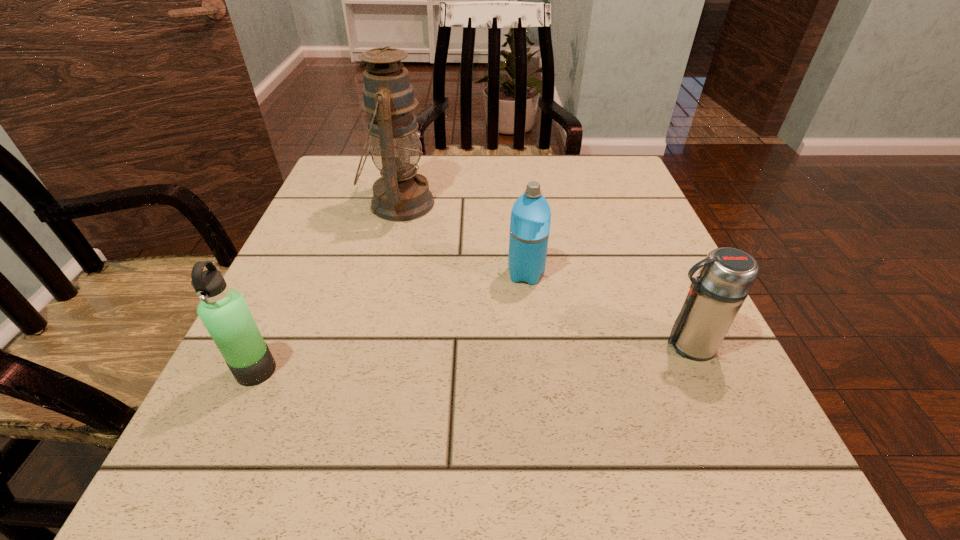
This screenshot has height=540, width=960. I want to click on free region located with a handle on the side of the rightmost thermos bottle, so click(x=532, y=345).

Where is `blank space located with a handle on the side of the rightmost thermos bottle`? Image resolution: width=960 pixels, height=540 pixels. blank space located with a handle on the side of the rightmost thermos bottle is located at coordinates (532, 345).

This screenshot has width=960, height=540. Find the location of `object located at the far edge`. object located at the far edge is located at coordinates (401, 194).

Locate an element on the screen. The width and height of the screenshot is (960, 540). oil lamp located at the left edge is located at coordinates (401, 194).

This screenshot has height=540, width=960. Identify the location of thermos bottle positioned at the left edge. (223, 311).

The width and height of the screenshot is (960, 540). Find the location of `object present at the right edge`. object present at the right edge is located at coordinates (727, 275).

Identify the location of object that is at the far left corner. This screenshot has width=960, height=540. pos(401,194).

You are a GUI agent. You are given a task and a screenshot of the screen. Output one action in this format:
    pyautogui.click(x=<x>, y=<y>)
    Task: Click on the vacant space at the far edge of the desktop
    The height and width of the screenshot is (540, 960).
    Given the screenshot: What is the action you would take?
    pyautogui.click(x=537, y=170)

Find the location of `vacant space at the near edge`. vacant space at the near edge is located at coordinates (403, 497).

What are the coordinates of `free space at the left edge` in the screenshot? It's located at (368, 225).